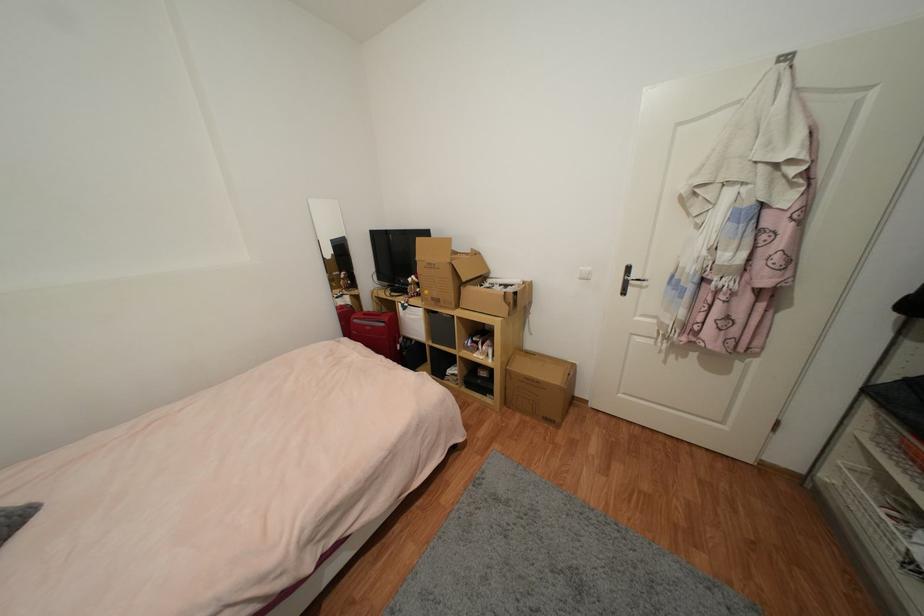
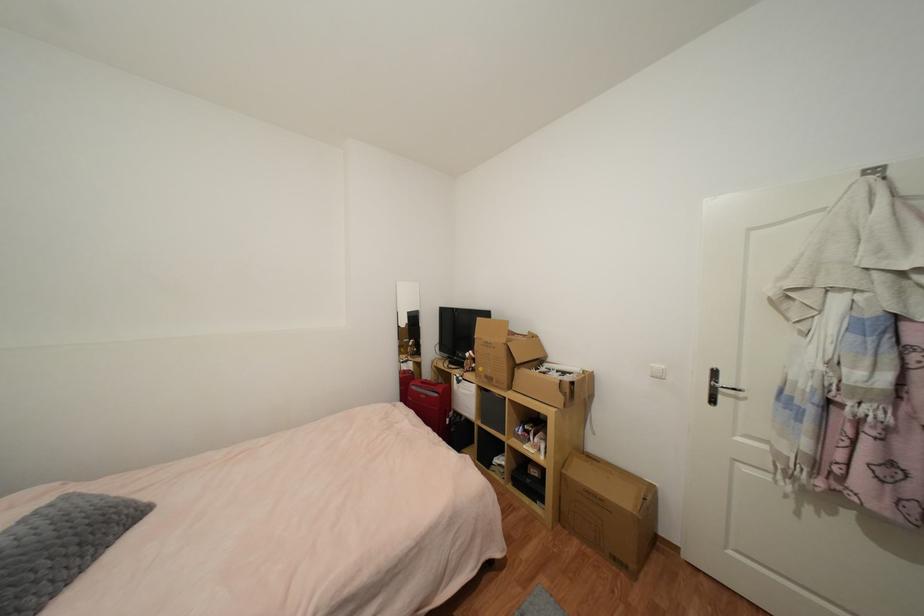
Where in the second image is the point corresponding to point (633, 270) from the first image?

(720, 374)